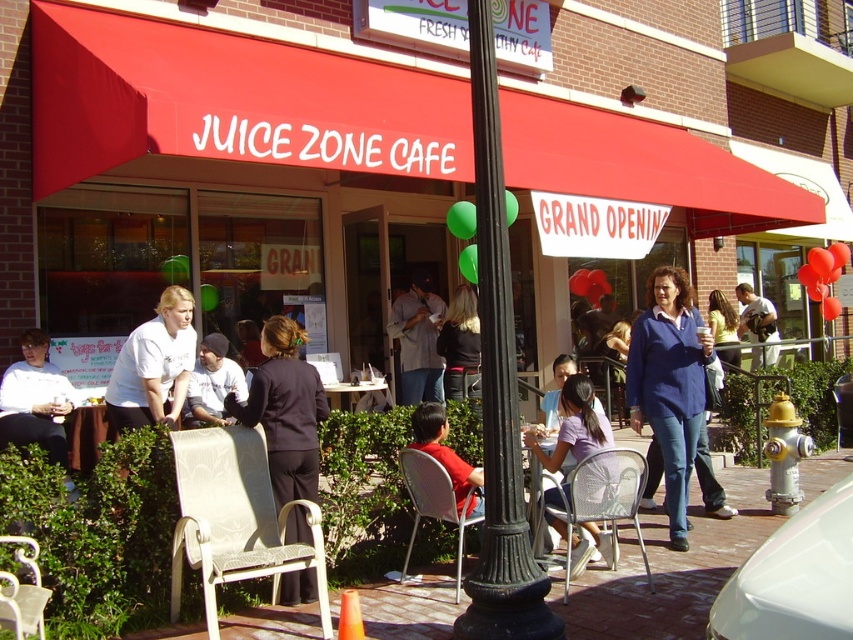
Question: Which object is the farthest from the dark blue suit at center?

Choices:
 (A) light brown leather jacket at center
 (B) white t-shirt at left

Answer: (A)

Question: Is blue cotton shirt at center positioned in front of white t-shirt at left?

Choices:
 (A) no
 (B) yes

Answer: (B)

Question: Can you confirm if black metal pole at center is thinner than white plastic table at center?

Choices:
 (A) yes
 (B) no

Answer: (A)

Question: Can you confirm if black metal pole at center is positioned above blue cotton shirt at center?

Choices:
 (A) no
 (B) yes

Answer: (B)

Question: Which object is closer to the camera taking this photo?

Choices:
 (A) white wicker chair at lower center
 (B) black fabric jacket at center
 (C) metallic silver chair at lower center
 (D) light brown leather jacket at center

Answer: (A)

Question: Which is farther from the light purple fabric shirt at center?

Choices:
 (A) white wicker chair at lower center
 (B) beige fabric chair at lower left

Answer: (B)